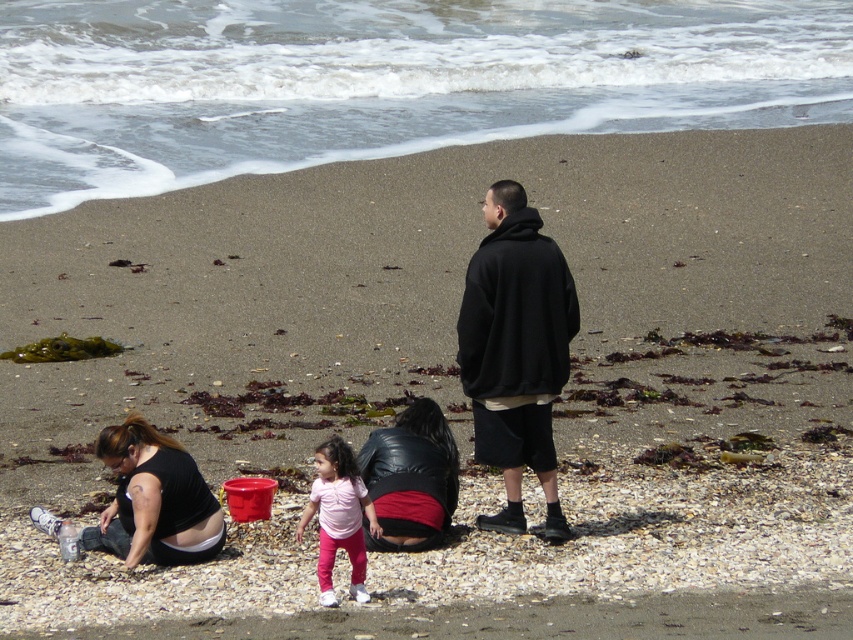
Question: Which object is positioned farthest from the pink matte pants at center?

Choices:
 (A) matte black shirt at lower left
 (B) black matte hoodie at center

Answer: (B)

Question: Among these objects, which one is nearest to the camera?

Choices:
 (A) black matte hoodie at center
 (B) matte black shirt at lower left
 (C) pink matte pants at center

Answer: (C)

Question: Is black matte hoodie at center thinner than pink matte pants at center?

Choices:
 (A) yes
 (B) no

Answer: (B)

Question: Does matte black shirt at lower left appear on the left side of pink matte pants at center?

Choices:
 (A) no
 (B) yes

Answer: (B)

Question: Does matte black shirt at lower left appear on the left side of pink matte pants at center?

Choices:
 (A) yes
 (B) no

Answer: (A)

Question: Which point is farther from the camera taking this photo?

Choices:
 (A) (138, 528)
 (B) (517, 244)

Answer: (B)